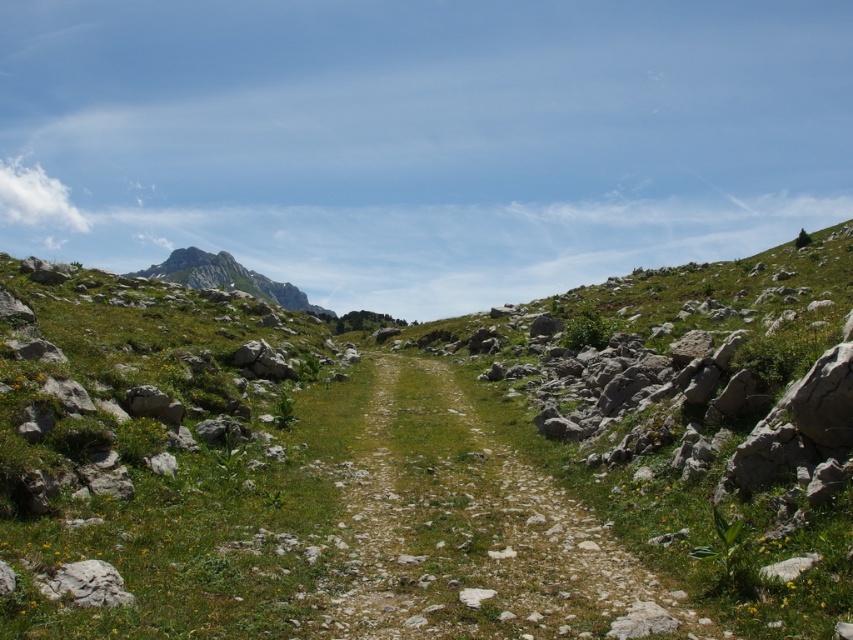
Question: Among these points, which one is farthest from the camera?

Choices:
 (A) (149, 445)
 (B) (94, 595)
 (C) (189, 253)

Answer: (C)

Question: Where is green grassy at center located in relation to rugged granite mountain at upper left in the image?

Choices:
 (A) left
 (B) right

Answer: (B)

Question: Which object is farther from the camera taking this photo?

Choices:
 (A) rugged granite mountain at upper left
 (B) green grassy at center
 (C) gray rough rock at lower left

Answer: (A)

Question: Does rugged granite mountain at upper left have a larger size compared to gray rough rock at lower left?

Choices:
 (A) yes
 (B) no

Answer: (A)

Question: Does green grassy at center have a smaller size compared to gray rough rock at lower left?

Choices:
 (A) yes
 (B) no

Answer: (B)

Question: Estimate the real-world distances between objects in this image. Which object is farther from the rugged granite mountain at upper left?

Choices:
 (A) green grassy at center
 (B) gray rough rock at lower left

Answer: (B)